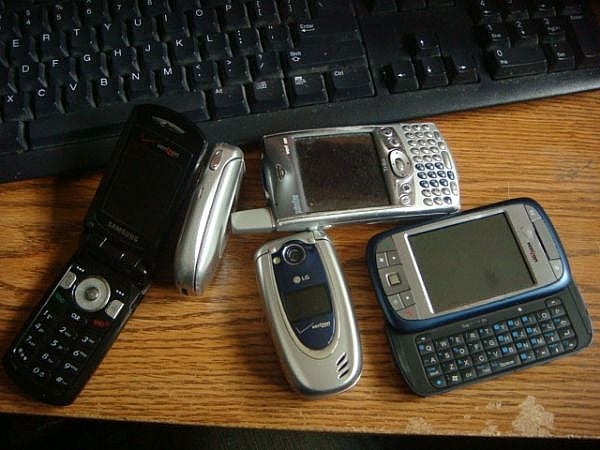
Where is `screen`? Image resolution: width=600 pixels, height=450 pixels. screen is located at coordinates (475, 265), (344, 173), (309, 306), (139, 201).